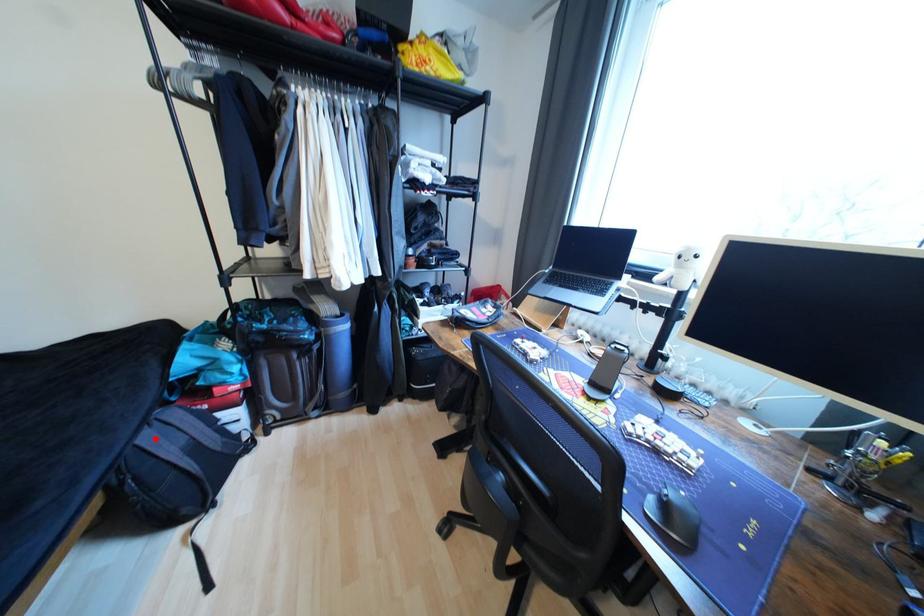
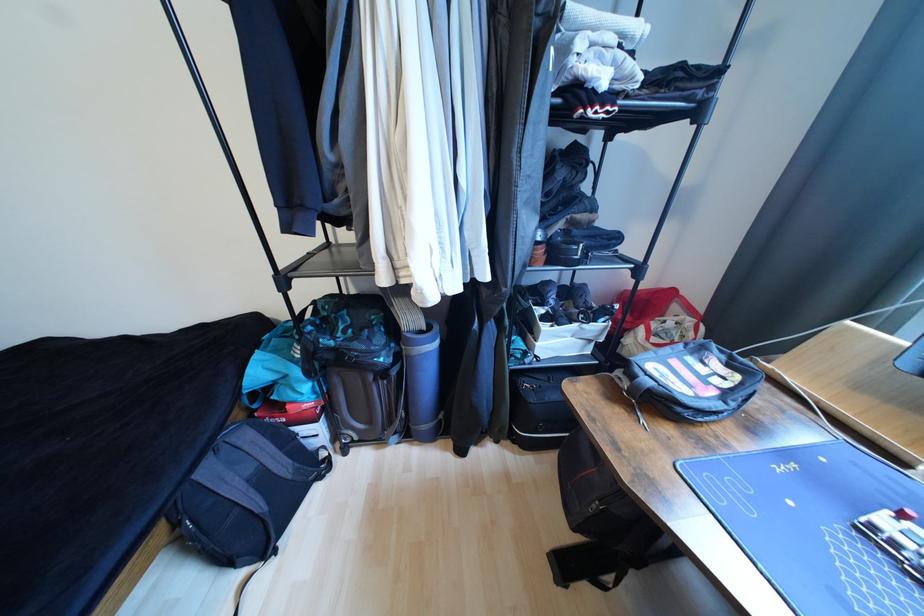
In the second image, find the point that corresponds to the highlighted location in the first image.

(215, 472)